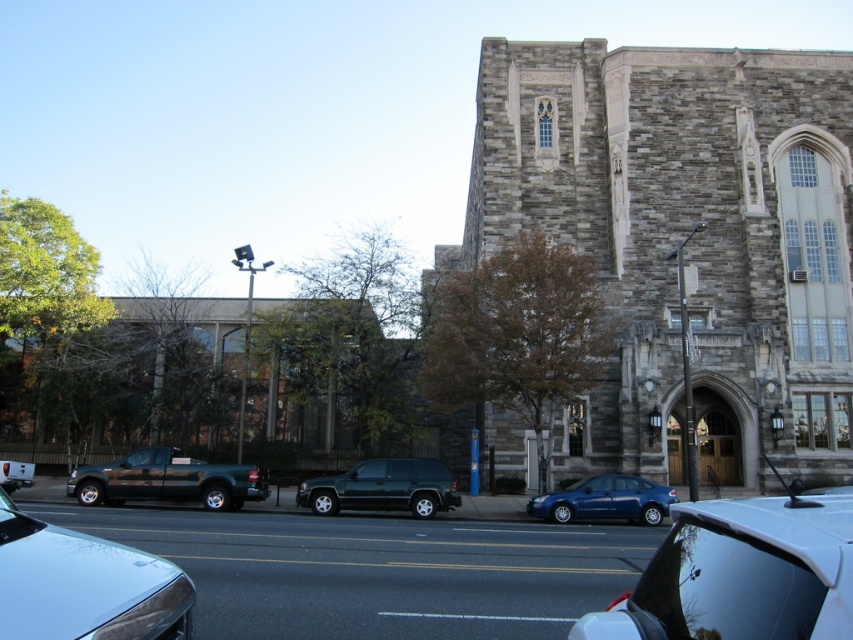
Is point (160, 474) farther from camera compared to point (624, 515)?

No, it is in front of (624, 515).

Does metallic green truck at center-left have a lesser width compared to matte blue sedan at center?

In fact, metallic green truck at center-left might be wider than matte blue sedan at center.

Which is in front, point (173, 448) or point (654, 515)?

Point (654, 515) is more forward.

Where is `metallic green truck at center-left`? The image size is (853, 640). metallic green truck at center-left is located at coordinates (167, 481).

Who is shorter, gray stone church at center or matte blue sedan at center?

With less height is matte blue sedan at center.

Who is more distant from viewer, (759, 465) or (578, 506)?

The point (759, 465) is behind.

I want to click on gray stone church at center, so click(x=686, y=244).

Based on the photo, between shiny silver sedan at lower left and matte black truck at center-left, which one appears on the left side from the viewer's perspective?

From the viewer's perspective, matte black truck at center-left appears more on the left side.

What do you see at coordinates (84, 586) in the screenshot? The width and height of the screenshot is (853, 640). I see `shiny silver sedan at lower left` at bounding box center [84, 586].

Which is in front, point (44, 616) or point (22, 461)?

Positioned in front is point (44, 616).

Where is `shiny silver sedan at lower left`? shiny silver sedan at lower left is located at coordinates (84, 586).